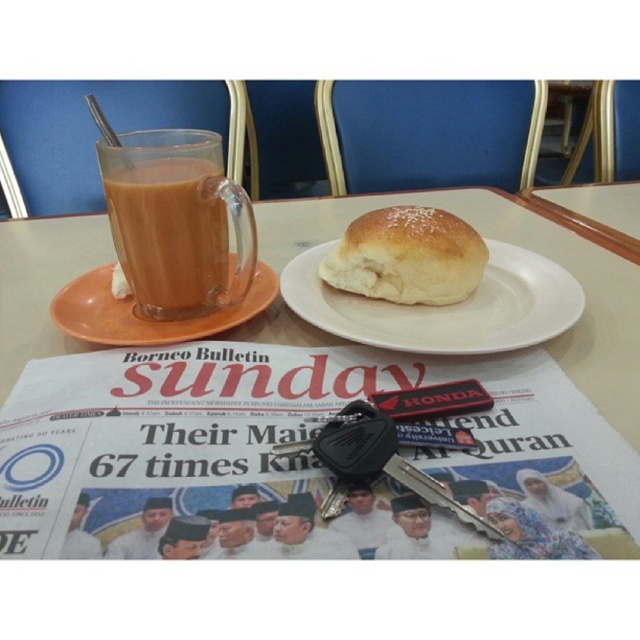
Question: Can you confirm if white glossy table at center is bigger than white matte plate at center?

Choices:
 (A) yes
 (B) no

Answer: (A)

Question: Is translucent glass mug at upper left positioned in front of white matte plate at center?

Choices:
 (A) no
 (B) yes

Answer: (A)

Question: Can you confirm if white matte plate at center is positioned to the left of golden brown bread at center?

Choices:
 (A) no
 (B) yes

Answer: (A)

Question: Which object is positioned closest to the white matte plate at center?

Choices:
 (A) golden brown bread at center
 (B) translucent glass mug at upper left
 (C) white glossy table at center

Answer: (A)

Question: Among these points, which one is farthest from the camera?

Choices:
 (A) (116, 458)
 (B) (388, 224)

Answer: (B)

Question: Which point is closer to the camera?

Choices:
 (A) (420, 195)
 (B) (342, 269)

Answer: (B)